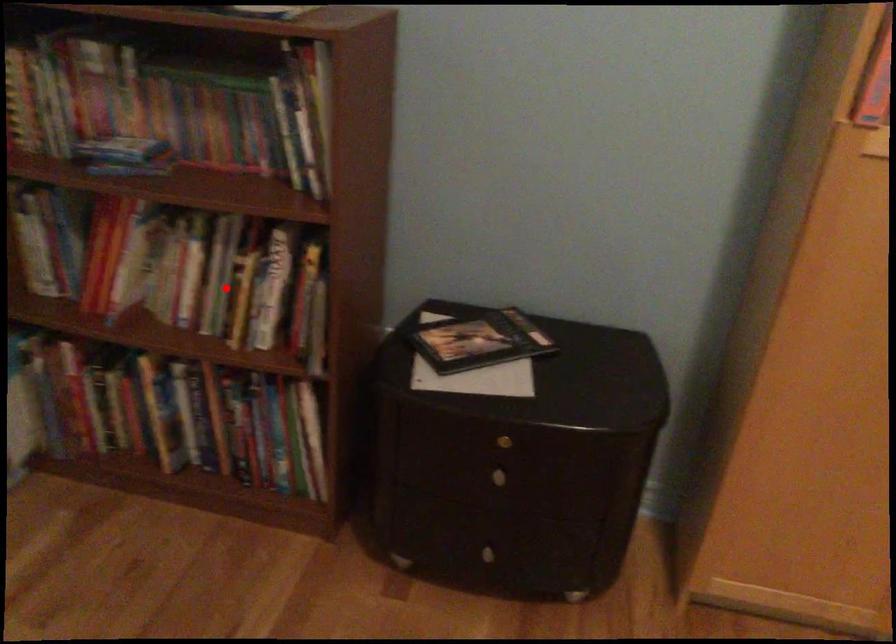
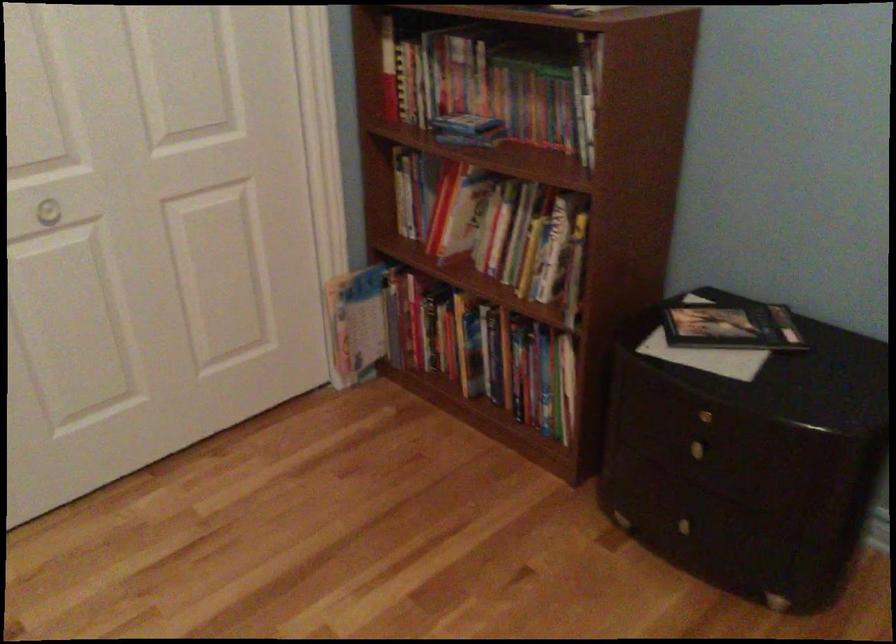
Find the pixel in the second image that matches the highlighted location in the first image.

(518, 243)